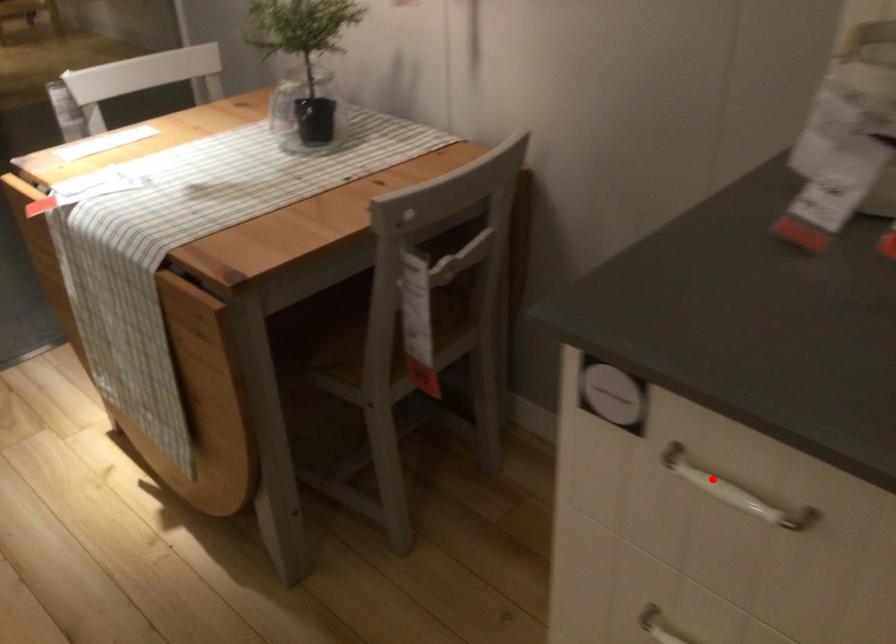
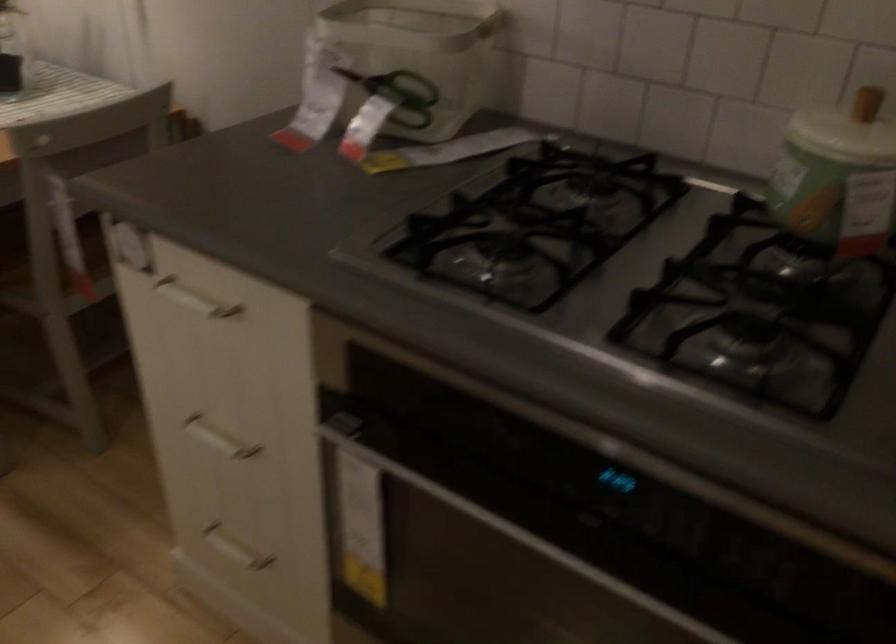
In the second image, find the point that corresponds to the highlighted location in the first image.

(194, 299)